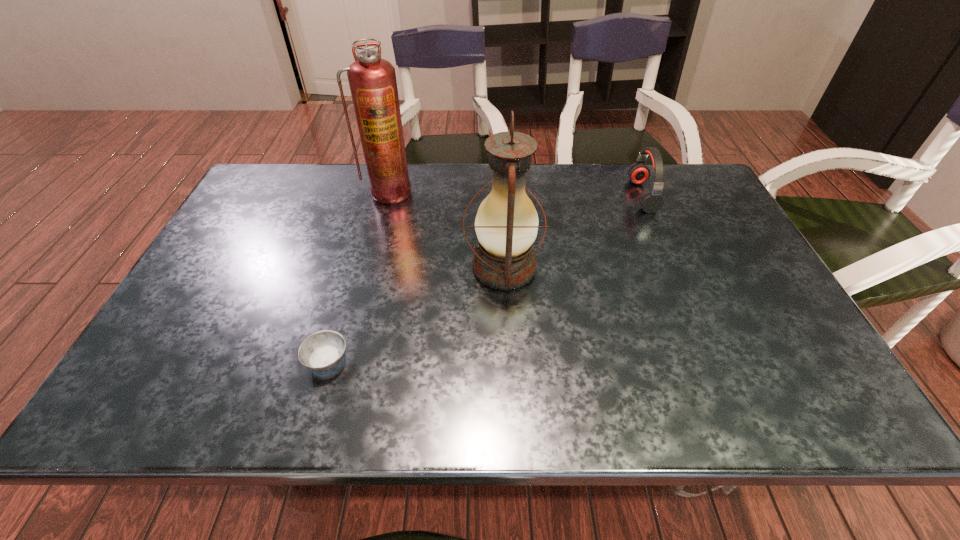
At what (x,y) coordinates should I click in order to perform the action: click on free space at the far left corner. Please return your answer as a coordinate pair (x, y). Looking at the image, I should click on (265, 186).

Where is `vacant area at the far right corner`? The height and width of the screenshot is (540, 960). vacant area at the far right corner is located at coordinates (701, 195).

Locate an element on the screen. Image resolution: width=960 pixels, height=540 pixels. vacant space at the near right corner is located at coordinates (781, 386).

Locate an element on the screen. free space between the third farthest object and the earphone is located at coordinates (573, 232).

The width and height of the screenshot is (960, 540). I want to click on vacant space in between the second shortest object and the third farthest object, so click(x=573, y=232).

Where is `vacant space in between the third object from left to right and the shortest object`? vacant space in between the third object from left to right and the shortest object is located at coordinates (416, 314).

You are a GUI agent. You are given a task and a screenshot of the screen. Output one action in this format:
    pyautogui.click(x=<x>, y=<y>)
    Task: Click on the unoccupied area between the nearest object and the oil lamp
    
    Given the screenshot: What is the action you would take?
    pyautogui.click(x=416, y=314)

The height and width of the screenshot is (540, 960). What are the coordinates of `vacant area that lies between the shortest object and the third farthest object` in the screenshot? It's located at [416, 314].

You are a GUI agent. You are given a task and a screenshot of the screen. Output one action in this format:
    pyautogui.click(x=<x>, y=<y>)
    Task: Click on the free spot between the fire extinguisher and the oil lamp
    This screenshot has width=960, height=540.
    Given the screenshot: What is the action you would take?
    pyautogui.click(x=446, y=230)

The height and width of the screenshot is (540, 960). What are the coordinates of `vacant space that's between the fire extinguisher and the shortest object` in the screenshot? It's located at (358, 276).